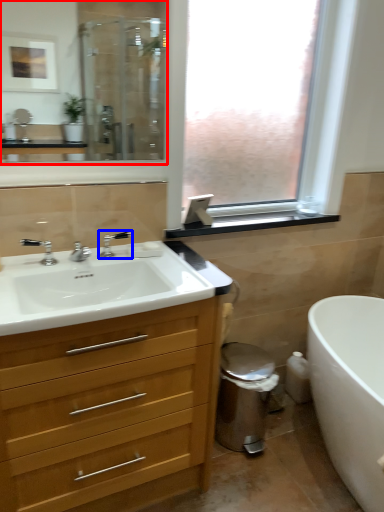
Question: Which point is further to the camera, mirror (highlighted by a red box) or tap (highlighted by a blue box)?

Choices:
 (A) mirror
 (B) tap

Answer: (B)